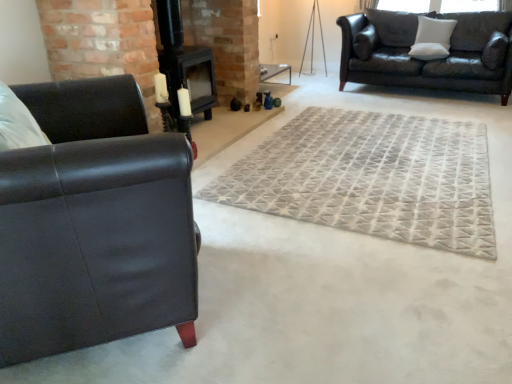
Question: Is black matte fireplace at center bigger than matte black couch at upper right, the 1th studio couch positioned from the top?

Choices:
 (A) yes
 (B) no

Answer: (B)

Question: Is black matte fireplace at center positioned behind matte black couch at upper right, the first studio couch viewed from the right?

Choices:
 (A) yes
 (B) no

Answer: (B)

Question: Considering the relative sizes of black matte fireplace at center and matte black couch at upper right, the second studio couch positioned from the left, in the image provided, is black matte fireplace at center shorter than matte black couch at upper right, the second studio couch positioned from the left,?

Choices:
 (A) no
 (B) yes

Answer: (A)

Question: Is black matte fireplace at center not close to matte black couch at upper right, the 1th studio couch viewed from the back?

Choices:
 (A) yes
 (B) no

Answer: (A)

Question: From the image's perspective, is black matte fireplace at center under matte black couch at upper right, the second studio couch positioned from the left?

Choices:
 (A) yes
 (B) no

Answer: (A)

Question: Is black matte fireplace at center positioned before matte black couch at upper right, the 1th studio couch viewed from the back?

Choices:
 (A) yes
 (B) no

Answer: (A)

Question: Can you confirm if white soft pillow at upper right, placed as the second pillow when sorted from left to right, is smaller than white soft cushion at upper right, acting as the second pillow starting from the right?

Choices:
 (A) yes
 (B) no

Answer: (B)

Question: Is white soft pillow at upper right, positioned as the first pillow in right-to-left order, turned away from white soft cushion at upper right, acting as the second pillow starting from the right?

Choices:
 (A) no
 (B) yes

Answer: (A)

Question: Does white soft pillow at upper right, positioned as the first pillow in right-to-left order, have a lesser height compared to white soft cushion at upper right, which is counted as the first pillow, starting from the left?

Choices:
 (A) yes
 (B) no

Answer: (A)

Question: Is white soft pillow at upper right, placed as the second pillow when sorted from left to right, positioned in front of white soft cushion at upper right, acting as the second pillow starting from the right?

Choices:
 (A) yes
 (B) no

Answer: (A)

Question: From the image's perspective, would you say white soft pillow at upper right, positioned as the first pillow in right-to-left order, is positioned over white soft cushion at upper right, acting as the second pillow starting from the right?

Choices:
 (A) no
 (B) yes

Answer: (A)

Question: Is white soft pillow at upper right, positioned as the first pillow in right-to-left order, with white soft cushion at upper right, which is counted as the first pillow, starting from the left?

Choices:
 (A) no
 (B) yes

Answer: (A)

Question: Is white soft pillow at upper right, positioned as the first pillow in right-to-left order, taller than gray textured rug at center?

Choices:
 (A) no
 (B) yes

Answer: (B)